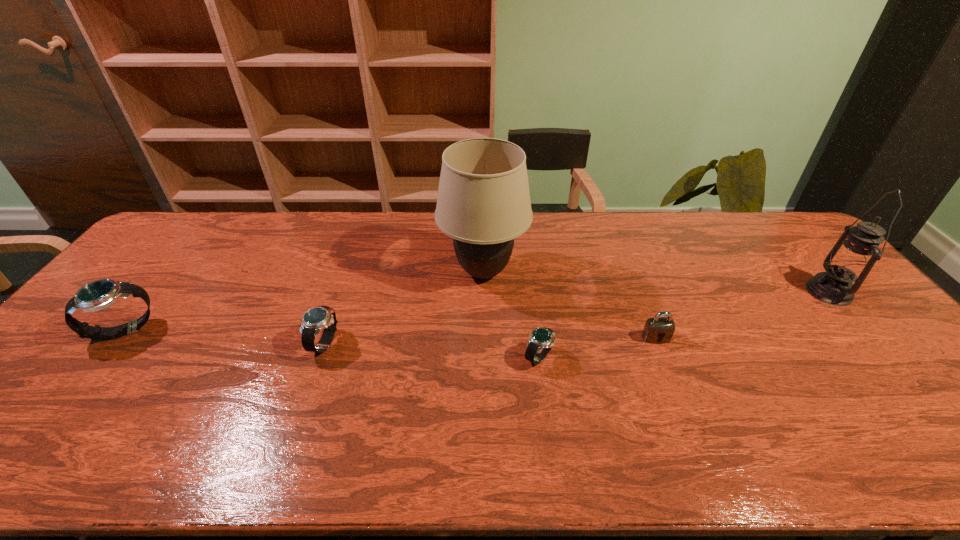
Where is `vacant point at the right edge`? vacant point at the right edge is located at coordinates (827, 325).

Locate an element on the screen. The image size is (960, 540). vacant space at the far left corner of the desktop is located at coordinates (178, 248).

Identify the location of vacant point at the far right corner. (795, 236).

At what (x,y) coordinates should I click in order to perform the action: click on free space that is in between the shortest object and the second object from left to right. Please return your answer as a coordinate pair (x, y). This screenshot has width=960, height=540. Looking at the image, I should click on (432, 350).

Where is `vacant space that's between the second object from right to left and the lampshade`? The width and height of the screenshot is (960, 540). vacant space that's between the second object from right to left and the lampshade is located at coordinates (569, 305).

Locate an element on the screen. empty space that is in between the fifth object from left to right and the shortest watch is located at coordinates (597, 348).

Identify the location of vacant area that lies between the padlock and the leftmost watch. This screenshot has width=960, height=540. (391, 334).

The width and height of the screenshot is (960, 540). Find the location of `vacant space that's between the tallest watch and the rightmost watch`. vacant space that's between the tallest watch and the rightmost watch is located at coordinates (332, 344).

The width and height of the screenshot is (960, 540). I want to click on vacant area between the rightmost watch and the fifth object from left to right, so click(x=597, y=348).

This screenshot has height=540, width=960. What are the coordinates of `vacant space that is in between the oil lamp and the third tallest object` in the screenshot? It's located at (477, 311).